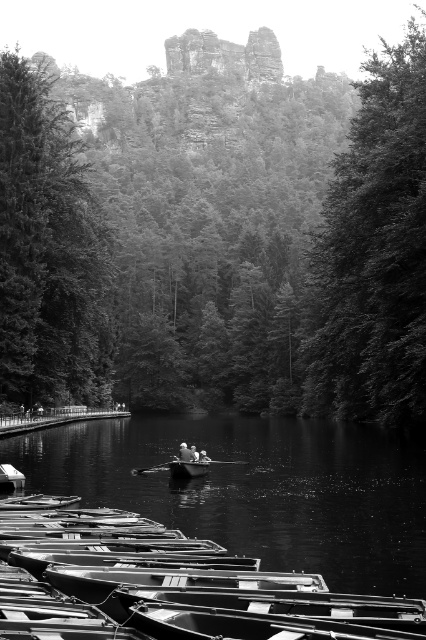
You are standing at the smooth wooden boat at lower left and want to reach the dark green leafy tree at center. Given that your walking speed is 1.5 meters per second, how many seconds will it take you to reach the tree?

The dark green leafy tree at center is 182.23 meters away from the smooth wooden boat at lower left. At a walking speed of 1.5 meters per second, it would take approximately 121.49 seconds to reach the tree.

You are standing at the edge of the water and want to throw a stone into the smooth dark water at center. To reach the water, do you need to walk past the smooth wooden boat at lower left?

The smooth dark water at center is closer to the viewer than the smooth wooden boat at lower left, so you don not need to walk past the smooth wooden boat at lower left to reach the smooth dark water at center.